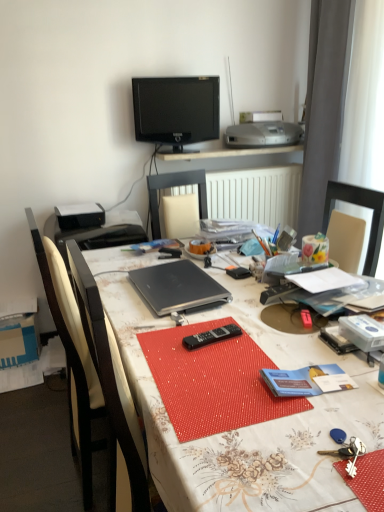
Question: Should I look upward or downward to see satin silver printer at upper center?

Choices:
 (A) up
 (B) down

Answer: (A)

Question: Could you tell me if black plastic remote control at center, the first stationery in the left-to-right sequence, is turned towards satin silver printer at upper center?

Choices:
 (A) no
 (B) yes

Answer: (A)

Question: From the image's perspective, does black plastic remote control at center, which is the second stationery from right to left, appear higher than satin silver printer at upper center?

Choices:
 (A) yes
 (B) no

Answer: (B)

Question: Would you say black plastic remote control at center, the first stationery in the left-to-right sequence, contains satin silver printer at upper center?

Choices:
 (A) no
 (B) yes

Answer: (A)

Question: Can you confirm if black plastic remote control at center, which is the second stationery from right to left, is shorter than satin silver printer at upper center?

Choices:
 (A) yes
 (B) no

Answer: (A)

Question: From a real-world perspective, is black plastic remote control at center, which is the second stationery from right to left, physically above satin silver printer at upper center?

Choices:
 (A) no
 (B) yes

Answer: (A)

Question: Is black plastic remote control at center, the first stationery in the left-to-right sequence, at the right side of satin silver printer at upper center?

Choices:
 (A) no
 (B) yes

Answer: (A)

Question: Can you confirm if black wood chair at left is taller than matte black laptop at center?

Choices:
 (A) no
 (B) yes

Answer: (B)

Question: From a real-world perspective, is black wood chair at left located beneath matte black laptop at center?

Choices:
 (A) yes
 (B) no

Answer: (B)

Question: From a real-world perspective, is black wood chair at left on matte black laptop at center?

Choices:
 (A) yes
 (B) no

Answer: (A)

Question: Considering the relative sizes of black wood chair at left and matte black laptop at center in the image provided, is black wood chair at left thinner than matte black laptop at center?

Choices:
 (A) no
 (B) yes

Answer: (B)

Question: Is black wood chair at left facing towards matte black laptop at center?

Choices:
 (A) no
 (B) yes

Answer: (B)

Question: Would you consider black wood chair at left to be distant from matte black laptop at center?

Choices:
 (A) no
 (B) yes

Answer: (A)

Question: From the image's perspective, is black plastic remote at center on top of satin silver printer at upper center?

Choices:
 (A) no
 (B) yes

Answer: (A)